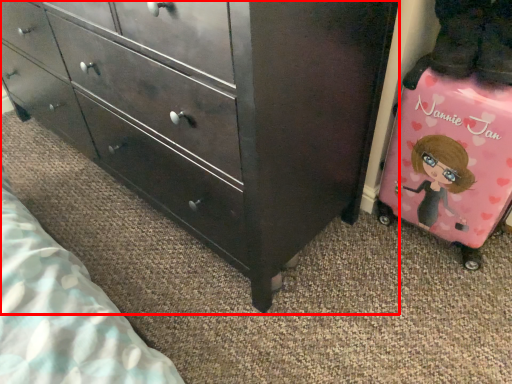
Question: Where is chest of drawers (annotated by the red box) located in relation to luggage in the image?

Choices:
 (A) left
 (B) right

Answer: (A)